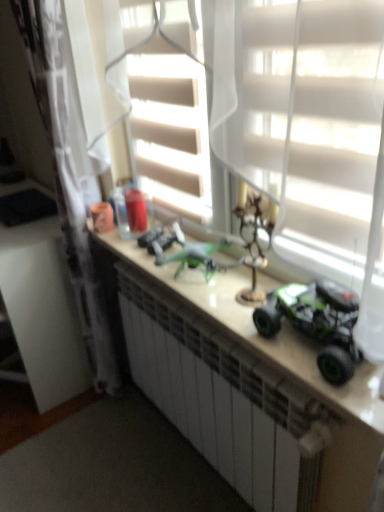
Question: Is metallic green drone at center, the second toy in the left-to-right sequence, wider than green matte toy car at right, which is counted as the 3th toy, starting from the back?

Choices:
 (A) yes
 (B) no

Answer: (B)

Question: From the image's perspective, is metallic green drone at center, positioned as the 2th toy in front-to-back order, below green matte toy car at right, the first toy positioned from the front?

Choices:
 (A) yes
 (B) no

Answer: (B)

Question: Could you tell me if metallic green drone at center, the second toy in the left-to-right sequence, is facing green matte toy car at right, which is counted as the 3th toy, starting from the back?

Choices:
 (A) yes
 (B) no

Answer: (B)

Question: Is metallic green drone at center, the second toy in the left-to-right sequence, facing away from green matte toy car at right, the first toy positioned from the front?

Choices:
 (A) no
 (B) yes

Answer: (A)

Question: Is metallic green drone at center, the 2th toy in the back-to-front sequence, positioned behind green matte toy car at right, which is counted as the 3th toy, starting from the back?

Choices:
 (A) no
 (B) yes

Answer: (B)

Question: From the image's perspective, relative to green plastic toy car at center, is white sheer curtain at left above or below?

Choices:
 (A) below
 (B) above

Answer: (B)

Question: Is point (57, 5) closer or farther from the camera than point (299, 351)?

Choices:
 (A) farther
 (B) closer

Answer: (A)

Question: Considering the positions of white sheer curtain at left and green plastic toy car at center in the image, is white sheer curtain at left bigger or smaller than green plastic toy car at center?

Choices:
 (A) big
 (B) small

Answer: (A)

Question: From a real-world perspective, relative to green plastic toy car at center, is white sheer curtain at left vertically above or below?

Choices:
 (A) below
 (B) above

Answer: (B)

Question: Is point (316, 350) positioned closer to the camera than point (327, 340)?

Choices:
 (A) closer
 (B) farther

Answer: (B)

Question: From a real-world perspective, is green plastic toy car at center physically located above or below green matte toy car at right, the first toy positioned from the front?

Choices:
 (A) above
 (B) below

Answer: (B)

Question: Based on their sizes in the image, would you say green plastic toy car at center is bigger or smaller than green matte toy car at right, the first toy positioned from the front?

Choices:
 (A) big
 (B) small

Answer: (A)

Question: From the image's perspective, is green plastic toy car at center positioned above or below green matte toy car at right, marked as the third toy in a left-to-right arrangement?

Choices:
 (A) above
 (B) below

Answer: (B)

Question: In the image, is green plastic toy car at center positioned in front of or behind green matte toy car at center, which ranks as the 3th toy in front-to-back order?

Choices:
 (A) front
 (B) behind

Answer: (A)

Question: In terms of height, does green plastic toy car at center look taller or shorter compared to green matte toy car at center, which ranks as the 3th toy in front-to-back order?

Choices:
 (A) tall
 (B) short

Answer: (A)